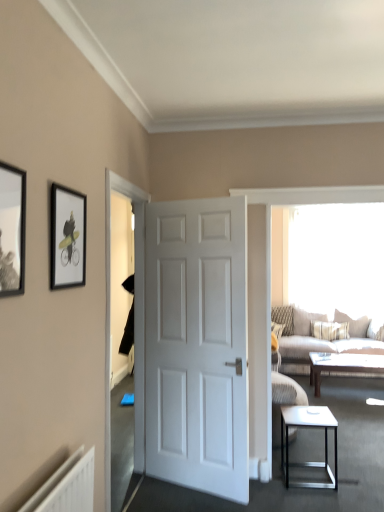
Question: From the image's perspective, would you say matte black picture frame at left, arranged as the second picture frame when viewed from the back, is positioned over white glossy side table at lower right?

Choices:
 (A) yes
 (B) no

Answer: (A)

Question: Can you confirm if matte black picture frame at left, the second picture frame from the right, is taller than white glossy side table at lower right?

Choices:
 (A) no
 (B) yes

Answer: (A)

Question: Is matte black picture frame at left, the second picture frame from the right, wider than white glossy side table at lower right?

Choices:
 (A) no
 (B) yes

Answer: (A)

Question: From a real-world perspective, is matte black picture frame at left, the 1th picture frame in the front-to-back sequence, located beneath white glossy side table at lower right?

Choices:
 (A) no
 (B) yes

Answer: (A)

Question: Is white glossy side table at lower right located within matte black picture frame at left, the 1th picture frame in the front-to-back sequence?

Choices:
 (A) yes
 (B) no

Answer: (B)

Question: From a real-world perspective, relative to matte black picture frame at left, the second picture frame from the right, is white glossy side table at lower right vertically above or below?

Choices:
 (A) above
 (B) below

Answer: (B)

Question: Would you say white glossy side table at lower right is to the left or to the right of matte black picture frame at left, acting as the first picture frame starting from the left, in the picture?

Choices:
 (A) right
 (B) left

Answer: (A)

Question: From the image's perspective, is white glossy side table at lower right positioned above or below matte black picture frame at left, the second picture frame from the right?

Choices:
 (A) above
 (B) below

Answer: (B)

Question: Is point (334, 429) positioned closer to the camera than point (6, 289)?

Choices:
 (A) farther
 (B) closer

Answer: (A)

Question: Is patterned fabric pillow at right, acting as the first pillow starting from the left, taller or shorter than white matte door at center?

Choices:
 (A) short
 (B) tall

Answer: (A)

Question: Visually, is patterned fabric pillow at right, acting as the first pillow starting from the left, positioned to the left or to the right of white matte door at center?

Choices:
 (A) left
 (B) right

Answer: (B)

Question: From the image's perspective, is patterned fabric pillow at right, acting as the first pillow starting from the left, above or below white matte door at center?

Choices:
 (A) above
 (B) below

Answer: (B)

Question: Based on their sizes in the image, would you say patterned fabric pillow at right, acting as the third pillow starting from the right, is bigger or smaller than white matte door at center?

Choices:
 (A) big
 (B) small

Answer: (B)

Question: From the image's perspective, relative to textured beige fabric couch at right, is matte black picture frame at upper left, the first picture frame when ordered from back to front, above or below?

Choices:
 (A) below
 (B) above

Answer: (B)

Question: In terms of height, does matte black picture frame at upper left, marked as the second picture frame in a left-to-right arrangement, look taller or shorter compared to textured beige fabric couch at right?

Choices:
 (A) short
 (B) tall

Answer: (A)